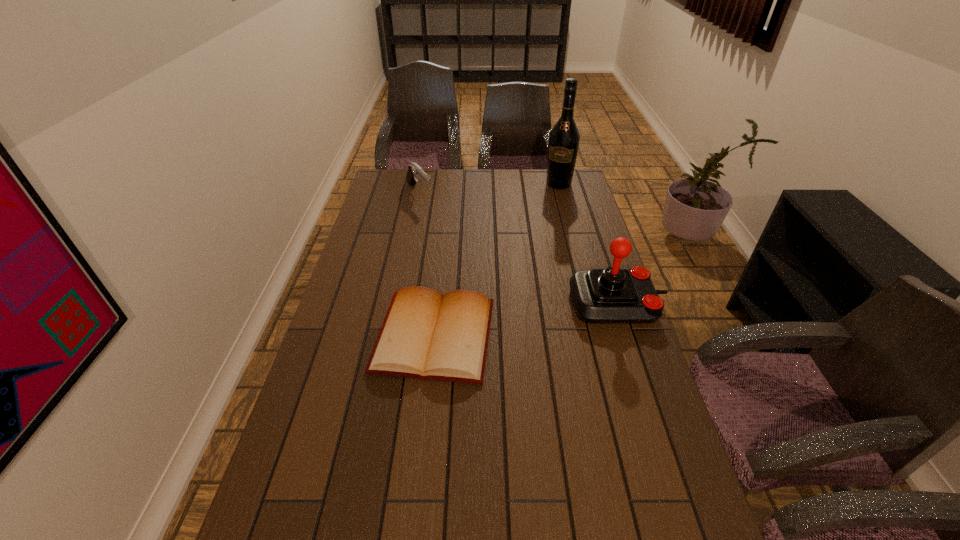
Locate an element on the screen. blank region between the tallest object and the joystick is located at coordinates (588, 244).

Where is `free space between the third tallest object and the joystick`? free space between the third tallest object and the joystick is located at coordinates (518, 248).

Image resolution: width=960 pixels, height=540 pixels. I want to click on blank region between the second tallest object and the wine bottle, so click(588, 244).

In order to click on free area in between the tallest object and the Bible in this screenshot , I will do `click(496, 260)`.

Locate which object ranks second in proximity to the Bible. Please provide its 2D coordinates. Your answer should be formatted as a tuple, i.e. [(x, y)], where the tuple contains the x and y coordinates of a point satisfying the conditions above.

[(415, 171)]

Select which object appears as the third closest to the shortest object. Please provide its 2D coordinates. Your answer should be formatted as a tuple, i.e. [(x, y)], where the tuple contains the x and y coordinates of a point satisfying the conditions above.

[(564, 138)]

The width and height of the screenshot is (960, 540). I want to click on free space that satisfies the following two spatial constraints: 1. on the front side of the joystick; 2. on the base of the gun, so click(x=397, y=302).

The width and height of the screenshot is (960, 540). I want to click on vacant area that satisfies the following two spatial constraints: 1. on the back side of the Bible; 2. on the base of the third shortest object, so click(x=438, y=302).

The image size is (960, 540). Find the location of `free space in the image that satisfies the following two spatial constraints: 1. on the back side of the tallest object; 2. on the left side of the Bible`. free space in the image that satisfies the following two spatial constraints: 1. on the back side of the tallest object; 2. on the left side of the Bible is located at coordinates (450, 184).